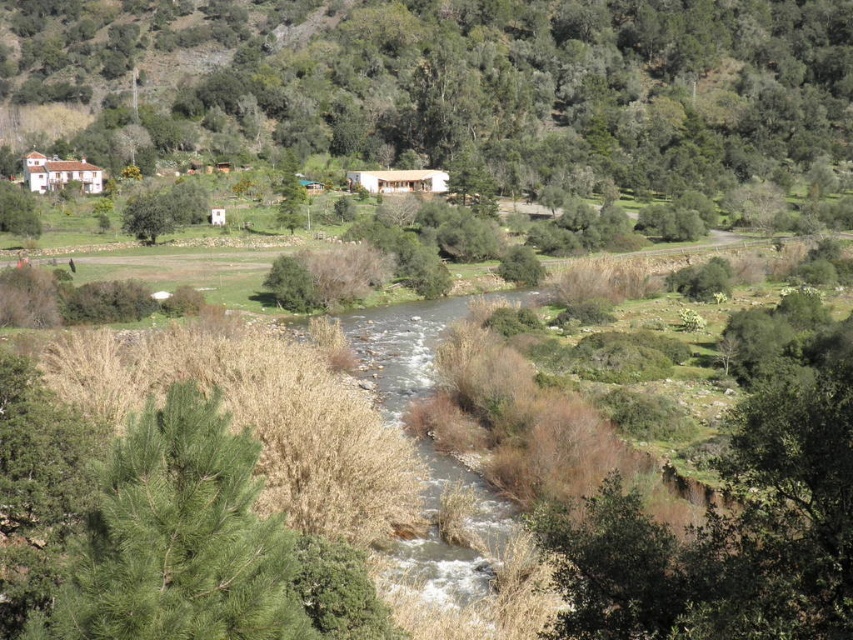
Which is more to the right, green leafy tree at upper left or brown grassy stream at center?

brown grassy stream at center is more to the right.

Does green leafy tree at upper left have a smaller size compared to brown grassy stream at center?

Incorrect, green leafy tree at upper left is not smaller in size than brown grassy stream at center.

Is point (776, 16) more distant than point (418, 316)?

Yes.

You are a GUI agent. You are given a task and a screenshot of the screen. Output one action in this format:
    pyautogui.click(x=<x>, y=<y>)
    Task: Click on the green leafy tree at upper left
    The width and height of the screenshot is (853, 640).
    Given the screenshot: What is the action you would take?
    pyautogui.click(x=444, y=84)

Does green leafy tree at upper left come in front of green matte tree at upper left?

That is False.

Is green leafy tree at upper left smaller than green matte tree at upper left?

Actually, green leafy tree at upper left might be larger than green matte tree at upper left.

Locate an element on the screen. green leafy tree at upper left is located at coordinates (444, 84).

Does green leafy tree at upper left have a lesser height compared to green matte tree at center?

Incorrect, green leafy tree at upper left's height does not fall short of green matte tree at center's.

Does green leafy tree at upper left appear under green matte tree at center?

Actually, green leafy tree at upper left is above green matte tree at center.

You are a GUI agent. You are given a task and a screenshot of the screen. Output one action in this format:
    pyautogui.click(x=<x>, y=<y>)
    Task: Click on the green leafy tree at upper left
    The height and width of the screenshot is (640, 853).
    Given the screenshot: What is the action you would take?
    [x=444, y=84]